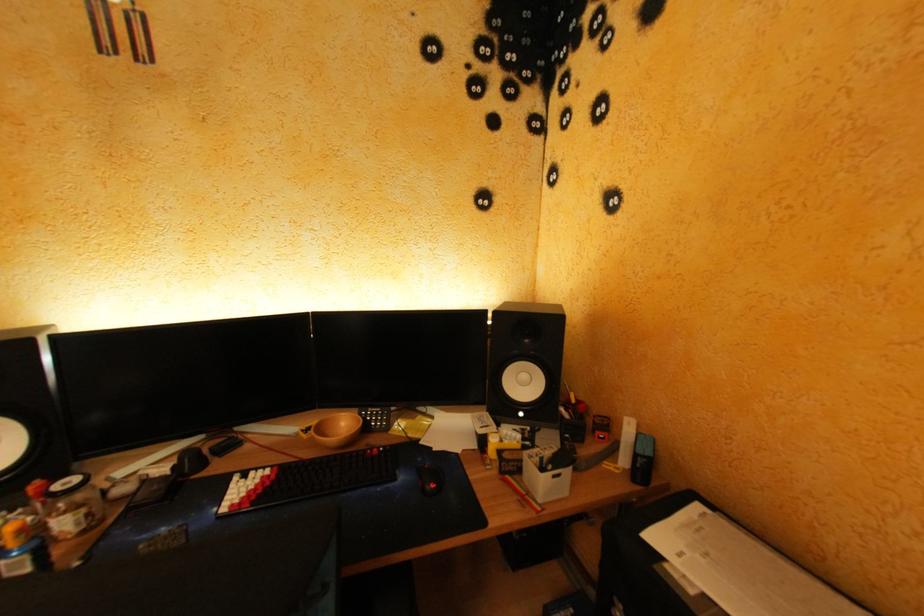
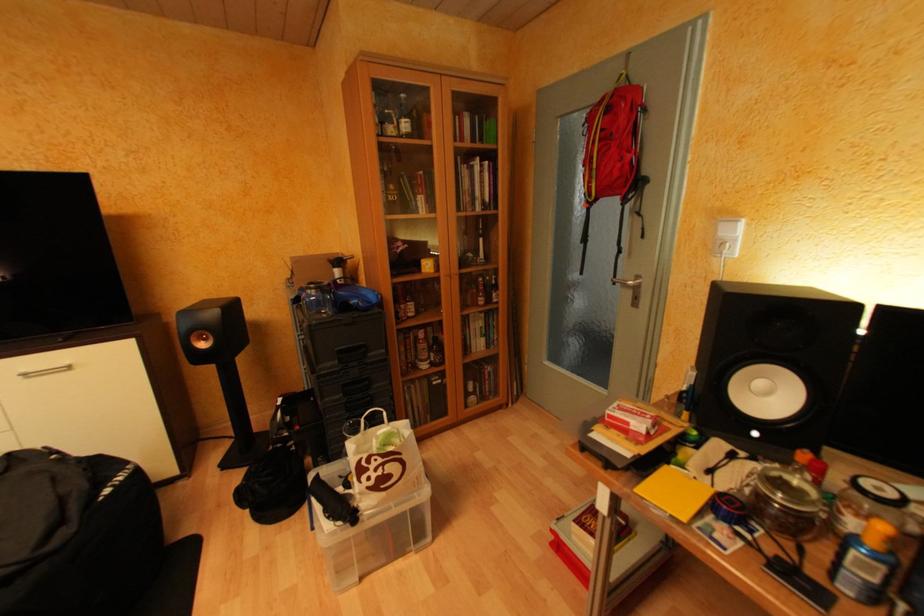
Question: The camera is either moving clockwise (left) or counter-clockwise (right) around the object. The first image is from the beginning of the video and the second image is from the end. Is the camera moving left or right when shooting the video?

Choices:
 (A) Left
 (B) Right

Answer: (B)